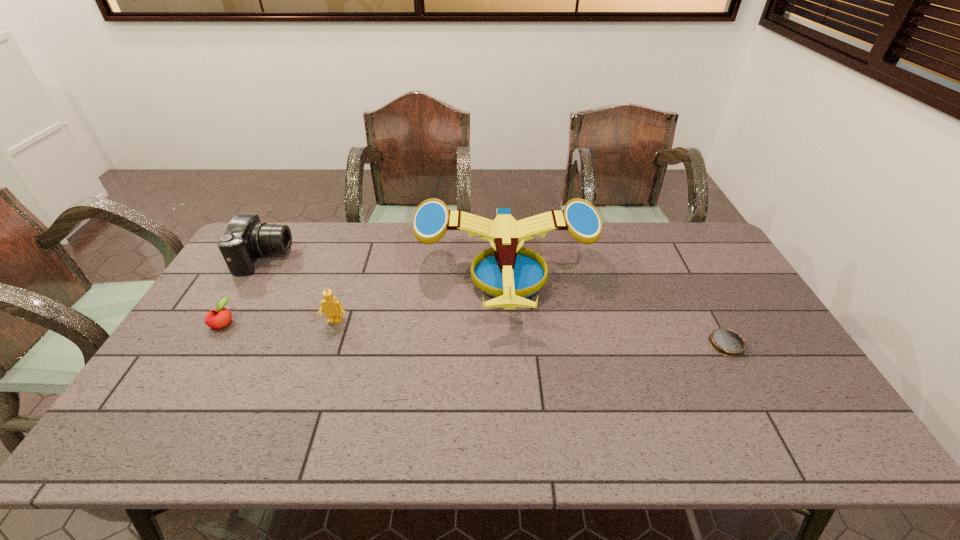
You are a GUI agent. You are given a task and a screenshot of the screen. Output one action in this format:
    pyautogui.click(x=<x>, y=<y>)
    Task: Click on the free region located on the face of the Lego
    The height and width of the screenshot is (540, 960).
    Given the screenshot: What is the action you would take?
    pyautogui.click(x=324, y=357)

The image size is (960, 540). I want to click on vacant space located 0.100m on the right of the fourth tallest object, so click(270, 321).

In order to click on vacant space situated 0.310m on the back of the rightmost object in this screenshot , I will do `click(682, 262)`.

Locate an element on the screen. drone that is at the far edge is located at coordinates (510, 273).

Image resolution: width=960 pixels, height=540 pixels. Identify the location of camera that is at the far edge. (246, 238).

Image resolution: width=960 pixels, height=540 pixels. I want to click on camera at the left edge, so click(246, 238).

Image resolution: width=960 pixels, height=540 pixels. I want to click on apple that is at the left edge, so click(220, 317).

The height and width of the screenshot is (540, 960). Identify the location of object that is at the right edge. (726, 342).

In order to click on object located in the far left corner section of the desktop in this screenshot , I will do `click(246, 238)`.

This screenshot has height=540, width=960. Find the location of `blank space at the far edge of the desktop`. blank space at the far edge of the desktop is located at coordinates (647, 240).